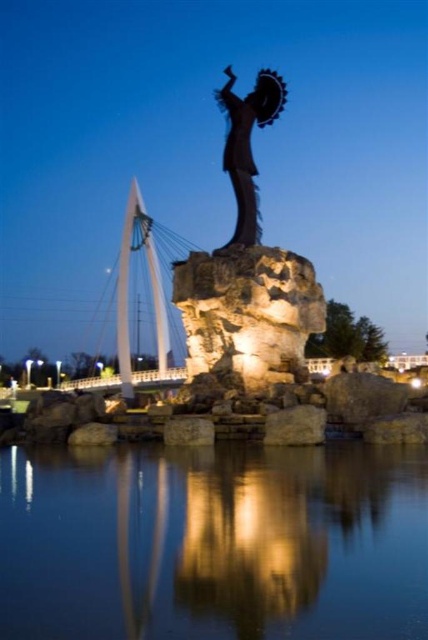
Question: Observing the image, what is the correct spatial positioning of black metal statue at center in reference to smooth beige rock at center?

Choices:
 (A) right
 (B) left

Answer: (B)

Question: Which of the following is the closest to the observer?

Choices:
 (A) smooth gray rock at center
 (B) smooth beige rock at center

Answer: (B)

Question: Does shiny bronze statue at center appear under smooth gray rock at center?

Choices:
 (A) yes
 (B) no

Answer: (B)

Question: Considering the relative positions of shiny bronze statue at center and smooth gray rock at center in the image provided, where is shiny bronze statue at center located with respect to smooth gray rock at center?

Choices:
 (A) left
 (B) right

Answer: (B)

Question: Which object is closer to the camera taking this photo?

Choices:
 (A) black metal statue at center
 (B) transparent glass water at center
 (C) shiny bronze statue at center

Answer: (B)

Question: Which of the following is the farthest from the observer?

Choices:
 (A) smooth gray rock at center
 (B) smooth beige rock at center
 (C) black metal statue at center
 (D) transparent glass water at center

Answer: (C)